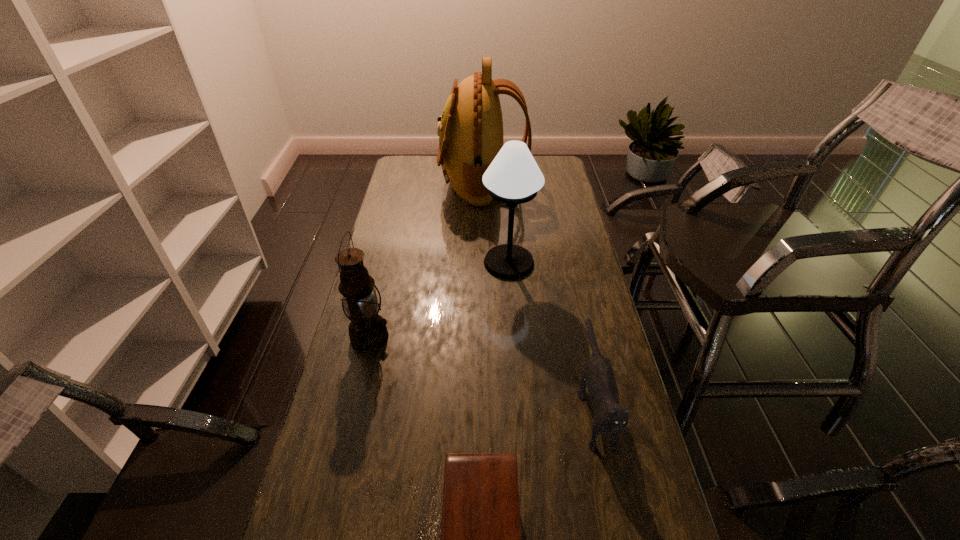
The image size is (960, 540). Identify the location of vacant space at the far right corner of the desktop. (563, 168).

Where is `vacant area between the farthest object and the fourth shortest object`? This screenshot has height=540, width=960. vacant area between the farthest object and the fourth shortest object is located at coordinates (495, 223).

Locate an element on the screen. free space between the tallest object and the fourth nearest object is located at coordinates (495, 223).

Where is `vacant space that's between the cat and the oil lamp`? The height and width of the screenshot is (540, 960). vacant space that's between the cat and the oil lamp is located at coordinates (482, 369).

Locate an element on the screen. empty space between the second tallest object and the tallest object is located at coordinates (495, 223).

Where is `empty location between the table lamp and the leftmost object`? The image size is (960, 540). empty location between the table lamp and the leftmost object is located at coordinates (440, 300).

The width and height of the screenshot is (960, 540). Find the location of `object that can be found as the fourth closest to the leftmost object`. object that can be found as the fourth closest to the leftmost object is located at coordinates (470, 130).

Locate which object ranks second in proximity to the table lamp. Please provide its 2D coordinates. Your answer should be formatted as a tuple, i.e. [(x, y)], where the tuple contains the x and y coordinates of a point satisfying the conditions above.

[(609, 417)]